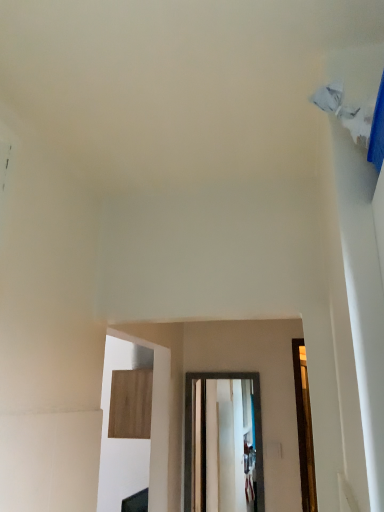
Question: Is wooden panel at center behind transparent glass door at center?

Choices:
 (A) yes
 (B) no

Answer: (A)

Question: Is wooden panel at center located outside transparent glass door at center?

Choices:
 (A) no
 (B) yes

Answer: (B)

Question: From the image's perspective, would you say wooden panel at center is positioned over transparent glass door at center?

Choices:
 (A) no
 (B) yes

Answer: (B)

Question: Can you confirm if wooden panel at center is thinner than transparent glass door at center?

Choices:
 (A) yes
 (B) no

Answer: (B)

Question: Would you say transparent glass door at center is part of wooden panel at center's contents?

Choices:
 (A) yes
 (B) no

Answer: (B)

Question: Does wooden panel at center come in front of transparent glass door at center?

Choices:
 (A) no
 (B) yes

Answer: (A)

Question: From the image's perspective, is transparent glass door at center below wooden panel at center?

Choices:
 (A) no
 (B) yes

Answer: (B)

Question: From a real-world perspective, is transparent glass door at center positioned over wooden panel at center based on gravity?

Choices:
 (A) yes
 (B) no

Answer: (B)

Question: Considering the relative positions of transparent glass door at center and wooden panel at center in the image provided, is transparent glass door at center to the left of wooden panel at center from the viewer's perspective?

Choices:
 (A) no
 (B) yes

Answer: (A)

Question: Are transparent glass door at center and wooden panel at center beside each other?

Choices:
 (A) no
 (B) yes

Answer: (A)

Question: Can you confirm if transparent glass door at center is shorter than wooden panel at center?

Choices:
 (A) yes
 (B) no

Answer: (B)

Question: Can you confirm if transparent glass door at center is smaller than wooden panel at center?

Choices:
 (A) yes
 (B) no

Answer: (A)

Question: Based on their positions, is wooden panel at center located to the left or right of transparent glass door at center?

Choices:
 (A) right
 (B) left

Answer: (B)